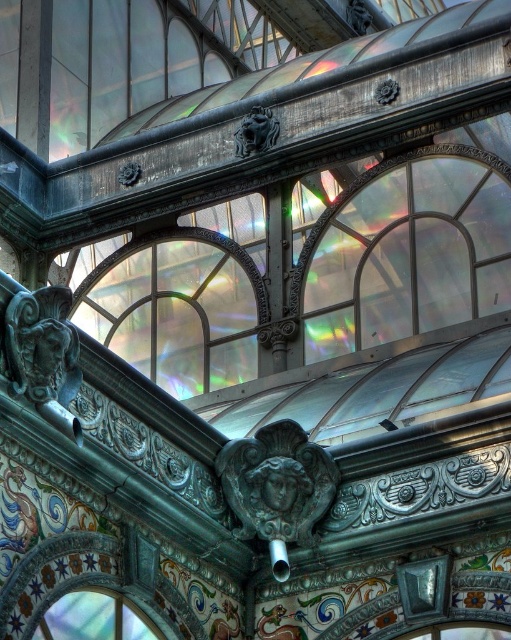
Question: Can you confirm if transparent iridescent glass at upper center is positioned to the right of translucent glass window at center?

Choices:
 (A) yes
 (B) no

Answer: (A)

Question: Which of the following is the closest to the observer?

Choices:
 (A) transparent iridescent glass at upper center
 (B) translucent glass window at lower center
 (C) translucent glass window at center

Answer: (B)

Question: Which point is closer to the camera?

Choices:
 (A) translucent glass window at center
 (B) transparent iridescent glass at upper center
 (C) translucent glass window at lower center

Answer: (C)

Question: Can you confirm if translucent glass window at center is smaller than translucent glass window at lower center?

Choices:
 (A) yes
 (B) no

Answer: (B)

Question: Is translucent glass window at center above translucent glass window at lower center?

Choices:
 (A) yes
 (B) no

Answer: (A)

Question: Which object is closer to the camera taking this photo?

Choices:
 (A) transparent iridescent glass at upper center
 (B) translucent glass window at center
 (C) translucent glass window at lower center

Answer: (C)